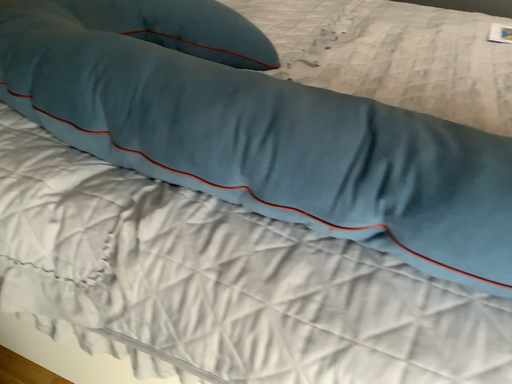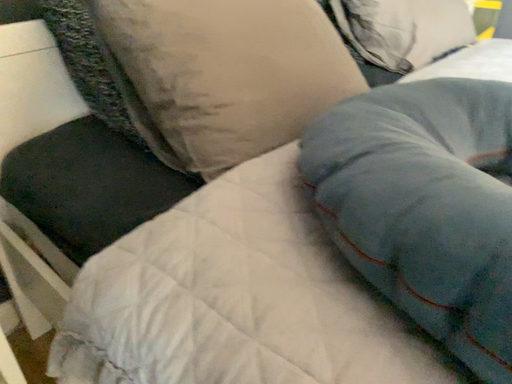
Question: Which way did the camera rotate in the video?

Choices:
 (A) rotated right
 (B) rotated left

Answer: (B)